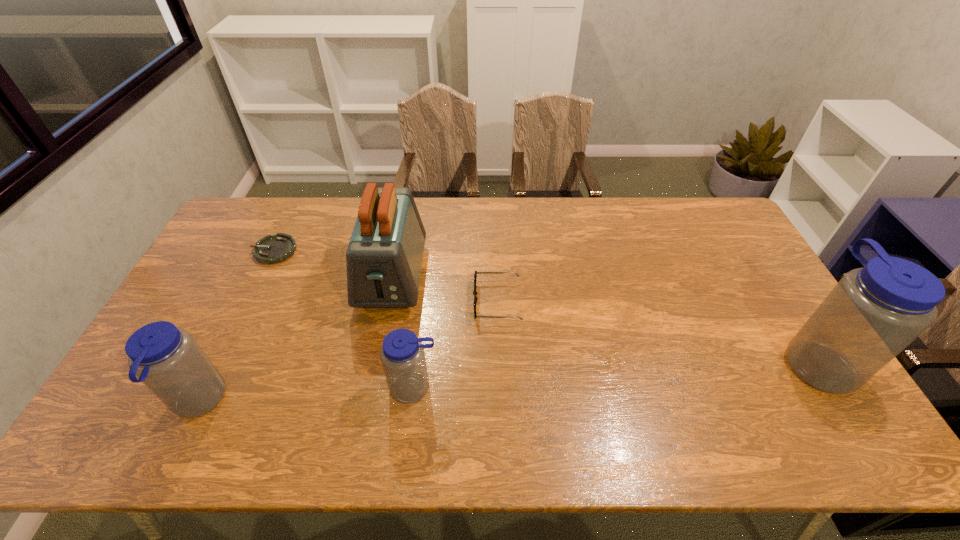
Locate an element on the screen. This screenshot has width=960, height=540. the leftmost water bottle is located at coordinates (167, 359).

Locate an element on the screen. the second tallest water bottle is located at coordinates (167, 359).

Image resolution: width=960 pixels, height=540 pixels. Find the location of `the third shortest object`. the third shortest object is located at coordinates (402, 355).

I want to click on the second water bottle from left to right, so click(402, 355).

Identify the location of the rightmost water bottle. The height and width of the screenshot is (540, 960). (873, 313).

Locate an element on the screen. The image size is (960, 540). the tallest water bottle is located at coordinates (873, 313).

Where is `ashtray`? Image resolution: width=960 pixels, height=540 pixels. ashtray is located at coordinates (271, 249).

This screenshot has width=960, height=540. Find the location of `toaster`. toaster is located at coordinates (384, 257).

At what (x,y) coordinates should I click in order to perform the action: click on the second object from right to left. Please return your answer as a coordinate pair (x, y). Looking at the image, I should click on (476, 272).

Where is `spectacles`? spectacles is located at coordinates (476, 272).